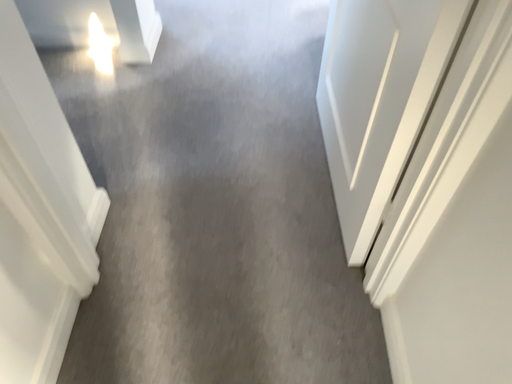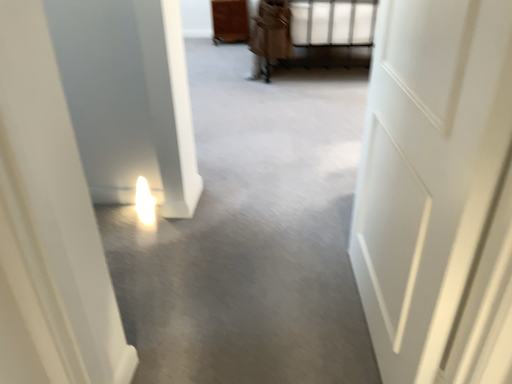
Question: How did the camera likely rotate when shooting the video?

Choices:
 (A) rotated downward
 (B) rotated upward

Answer: (B)